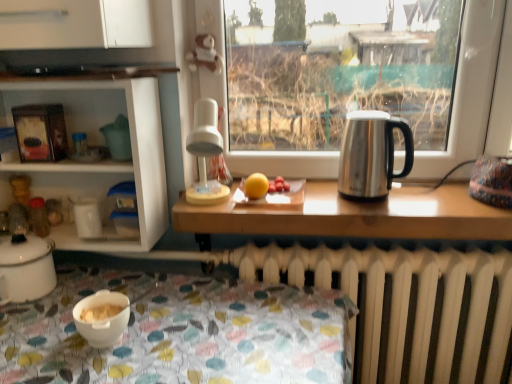
This screenshot has height=384, width=512. What do you see at coordinates (102, 318) in the screenshot?
I see `white matte bowl at lower left` at bounding box center [102, 318].

Where is `yellow matte orange at center`? This screenshot has height=384, width=512. yellow matte orange at center is located at coordinates (256, 186).

This screenshot has width=512, height=384. In order to click on white plastic lamp at center in this screenshot , I will do `click(205, 154)`.

Image resolution: width=512 pixels, height=384 pixels. Describe the element at coordinates (97, 144) in the screenshot. I see `white glossy shelves at left` at that location.

Locate an element on the screen. The image size is (512, 384). smooth red tomatoes at center is located at coordinates (279, 185).

What do you see at coordinates (279, 185) in the screenshot?
I see `smooth red tomatoes at center` at bounding box center [279, 185].

What do you see at coordinates (371, 154) in the screenshot?
I see `stainless steel kettle at right` at bounding box center [371, 154].

This screenshot has height=384, width=512. Identify the location of white matte bowl at lower left. (102, 318).

Can you tell me how much stainless steel kettle at right and white matte bowl at lower left differ in facing direction?

stainless steel kettle at right and white matte bowl at lower left are facing 2.73 degrees away from each other.

From a real-world perspective, is stainless steel kettle at right over white matte bowl at lower left?

Correct, in the physical world, stainless steel kettle at right is higher than white matte bowl at lower left.

Would you say stainless steel kettle at right is a long distance from white matte bowl at lower left?

No, there isn't a large distance between stainless steel kettle at right and white matte bowl at lower left.

Is smooth red tomatoes at center looking in the opposite direction of white enamel pot at lower left?

No.

Considering the sizes of objects smooth red tomatoes at center and white enamel pot at lower left in the image provided, who is taller, smooth red tomatoes at center or white enamel pot at lower left?

With more height is white enamel pot at lower left.

Measure the distance from smooth red tomatoes at center to white enamel pot at lower left.

smooth red tomatoes at center and white enamel pot at lower left are 26.82 inches apart from each other.

Which object is positioned more to the right, smooth red tomatoes at center or white enamel pot at lower left?

From the viewer's perspective, smooth red tomatoes at center appears more on the right side.

In the image, is white enamel pot at lower left on the left side or the right side of white plastic lamp at center?

From the image, it's evident that white enamel pot at lower left is to the left of white plastic lamp at center.

From the image's perspective, is white enamel pot at lower left under white plastic lamp at center?

Yes, from the image's perspective, white enamel pot at lower left is below white plastic lamp at center.

Is white enamel pot at lower left wider or thinner than white plastic lamp at center?

Considering their sizes, white enamel pot at lower left looks slimmer than white plastic lamp at center.

How far apart are yellow matte orange at center and white matte bowl at lower left?

yellow matte orange at center is 47.56 centimeters away from white matte bowl at lower left.

Consider the image. Considering the positions of objects yellow matte orange at center and white matte bowl at lower left in the image provided, who is more to the left, yellow matte orange at center or white matte bowl at lower left?

white matte bowl at lower left.

How different are the orientations of yellow matte orange at center and white matte bowl at lower left in degrees?

The angle between the facing direction of yellow matte orange at center and the facing direction of white matte bowl at lower left is 1.08 degrees.

Which is closer to the camera, (246,180) or (96,324)?

Point (246,180) is farther from the camera than point (96,324).

Is white matte bowl at lower left at the back of white plastic lamp at center?

No, white plastic lamp at center's orientation is not away from white matte bowl at lower left.

Looking at this image, can you tell me how much white plastic lamp at center and white matte bowl at lower left differ in facing direction?

The facing directions of white plastic lamp at center and white matte bowl at lower left are 2.73 degrees apart.

Can you confirm if white plastic lamp at center is taller than white matte bowl at lower left?

Correct, white plastic lamp at center is much taller as white matte bowl at lower left.

Does white plastic lamp at center lie behind white matte bowl at lower left?

Yes, it is.

Between yellow matte orange at center and stainless steel kettle at right, which one has larger size?

stainless steel kettle at right is bigger.

Relative to stainless steel kettle at right, is yellow matte orange at center in front or behind?

Clearly, yellow matte orange at center is behind stainless steel kettle at right.

Consider the image. Which is correct: yellow matte orange at center is inside stainless steel kettle at right, or outside of it?

yellow matte orange at center is located beyond the bounds of stainless steel kettle at right.

In the scene shown: Are yellow matte orange at center and stainless steel kettle at right located far from each other?

They are positioned close to each other.

Is stainless steel kettle at right located within white matte bowl at lower left?

That's incorrect, stainless steel kettle at right is not inside white matte bowl at lower left.

Is white matte bowl at lower left in front of stainless steel kettle at right?

Yes.

From the image's perspective, between white matte bowl at lower left and stainless steel kettle at right, who is located below?

white matte bowl at lower left.

Is white matte bowl at lower left shorter than stainless steel kettle at right?

Correct, white matte bowl at lower left is not as tall as stainless steel kettle at right.

Find the location of a particular element. This screenshot has height=384, width=512. kettle above the white matte bowl at lower left (from the image's perspective) is located at coordinates (371, 154).

I want to click on food on the right side of white enamel pot at lower left, so click(279, 185).

Based on the photo, which object lies further to the anchor point white plastic lamp at center, white enamel pot at lower left or yellow matte orange at center?

The object further to white plastic lamp at center is white enamel pot at lower left.

When comparing their distances from white enamel pot at lower left, does white matte bowl at lower left or white glossy shelves at left seem closer?

white matte bowl at lower left.

Looking at the image, which one is located further to smooth red tomatoes at center, white matte bowl at lower left or white enamel pot at lower left?

Based on the image, white enamel pot at lower left appears to be further to smooth red tomatoes at center.

When comparing their distances from yellow matte orange at center, does white matte bowl at lower left or smooth red tomatoes at center seem further?

The object further to yellow matte orange at center is white matte bowl at lower left.

Which object lies nearer to the anchor point smooth red tomatoes at center, white matte bowl at lower left or yellow matte orange at center?

yellow matte orange at center is positioned closer to the anchor smooth red tomatoes at center.

From the image, which object appears to be farther from white plastic lamp at center, yellow matte orange at center or smooth red tomatoes at center?

Among the two, smooth red tomatoes at center is located further to white plastic lamp at center.

Based on their spatial positions, is white matte bowl at lower left or stainless steel kettle at right further from smooth red tomatoes at center?

The object further to smooth red tomatoes at center is white matte bowl at lower left.

Which object lies further to the anchor point stainless steel kettle at right, white plastic lamp at center or yellow matte orange at center?

white plastic lamp at center is positioned further to the anchor stainless steel kettle at right.

In order to click on lamp between white matte bowl at lower left and stainless steel kettle at right in the horizontal direction in this screenshot , I will do `click(205, 154)`.

This screenshot has height=384, width=512. Find the location of `orange located between white glossy shelves at left and smooth red tomatoes at center in the left-right direction`. orange located between white glossy shelves at left and smooth red tomatoes at center in the left-right direction is located at coordinates (256, 186).

This screenshot has height=384, width=512. What are the coordinates of `shelf between white enamel pot at lower left and white plastic lamp at center in the horizontal direction` in the screenshot? It's located at (97, 144).

What are the coordinates of `food situated between yellow matte orange at center and stainless steel kettle at right from left to right` in the screenshot? It's located at (279, 185).